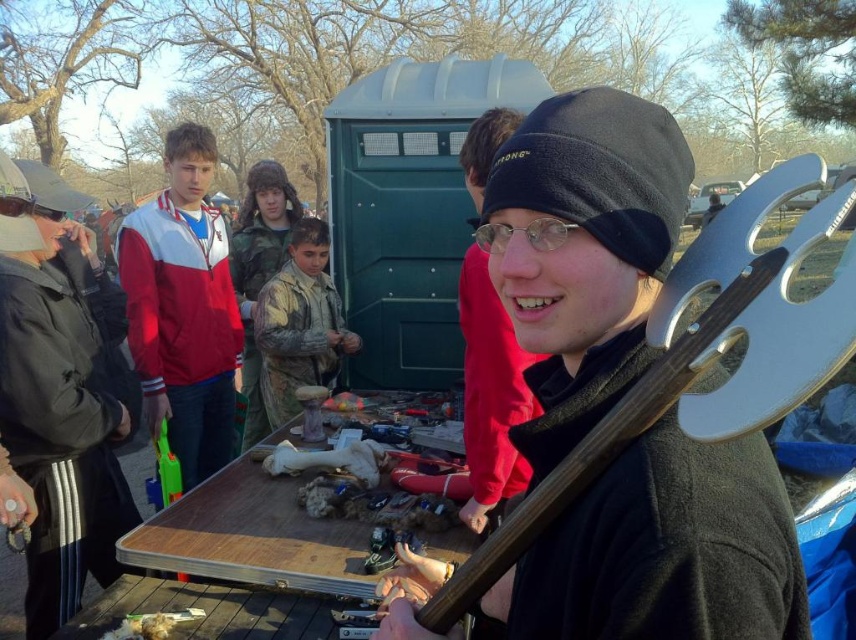
Question: Does matte black beanie at upper center appear on the left side of camouflage fabric boy at center?

Choices:
 (A) no
 (B) yes

Answer: (A)

Question: Which point appears closest to the camera in this image?

Choices:
 (A) pos(522,410)
 (B) pos(360,579)
 (C) pos(293,256)

Answer: (B)

Question: Is matte black beanie at upper center in front of camouflage fabric boy at center?

Choices:
 (A) yes
 (B) no

Answer: (A)

Question: Is wooden table at center smaller than camouflage fabric boy at center?

Choices:
 (A) yes
 (B) no

Answer: (A)

Question: Based on their relative distances, which object is farther from the camouflage fabric boy at center?

Choices:
 (A) matte black beanie at upper center
 (B) wooden table at center

Answer: (A)

Question: Based on their relative distances, which object is nearer to the wooden table at center?

Choices:
 (A) camouflage fabric boy at center
 (B) matte black beanie at upper center

Answer: (B)